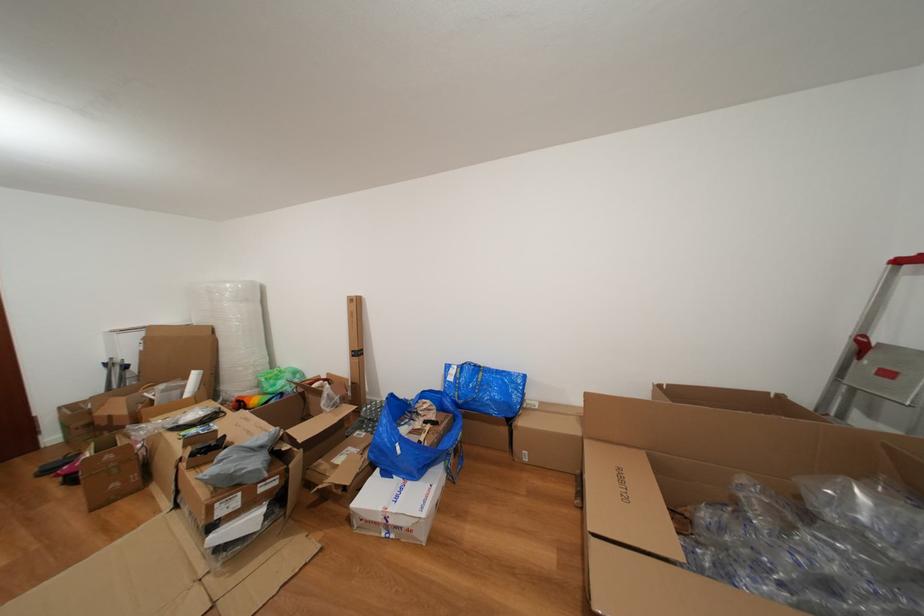
The image size is (924, 616). Describe the element at coordinates (397, 506) in the screenshot. I see `the white Intersport box` at that location.